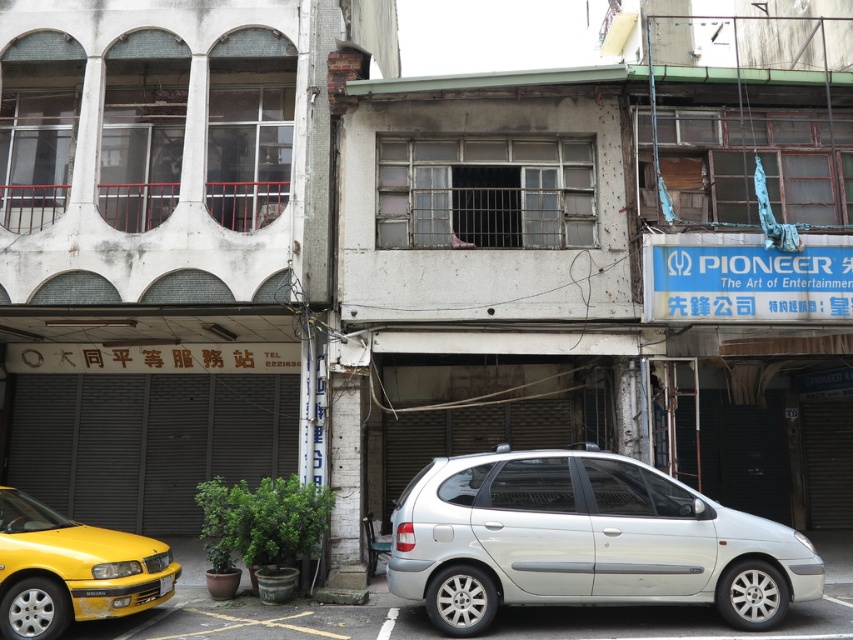
Does silver metallic minivan at center have a smaller size compared to shiny yellow taxi at lower left?

No, silver metallic minivan at center is not smaller than shiny yellow taxi at lower left.

Is point (631, 561) positioned behind point (10, 531)?

No, (631, 561) is in front of (10, 531).

Find the location of a particular element. Image resolution: width=853 pixels, height=640 pixels. silver metallic minivan at center is located at coordinates (584, 540).

Is shiny yellow taxi at lower left bigger than yellow plastic license plate at lower left?

Correct, shiny yellow taxi at lower left is larger in size than yellow plastic license plate at lower left.

Which is behind, point (143, 596) or point (173, 580)?

The point (173, 580) is behind.

Is point (78, 611) more distant than point (167, 577)?

That is False.

Find the location of a particular element. Image resolution: width=853 pixels, height=640 pixels. shiny yellow taxi at lower left is located at coordinates 70,570.

Measure the distance between point (489,484) and camera.

Point (489,484) is 8.13 meters from camera.

Can you confirm if silver metallic minivan at center is taller than yellow plastic license plate at lower left?

Yes.

What do you see at coordinates (584, 540) in the screenshot? I see `silver metallic minivan at center` at bounding box center [584, 540].

Where is `silver metallic minivan at center`? The width and height of the screenshot is (853, 640). silver metallic minivan at center is located at coordinates (584, 540).